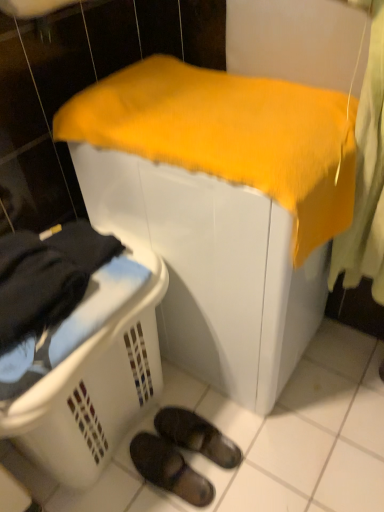
Find the location of a particular element. This screenshot has height=512, width=384. free space to the left of black suede slippers at lower center, which is counted as the first footwear, starting from the top is located at coordinates (127, 466).